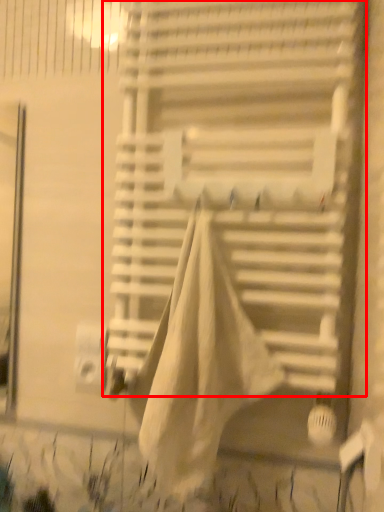
Question: Observing the image, what is the correct spatial positioning of window blind (annotated by the red box) in reference to blanket?

Choices:
 (A) left
 (B) right

Answer: (B)